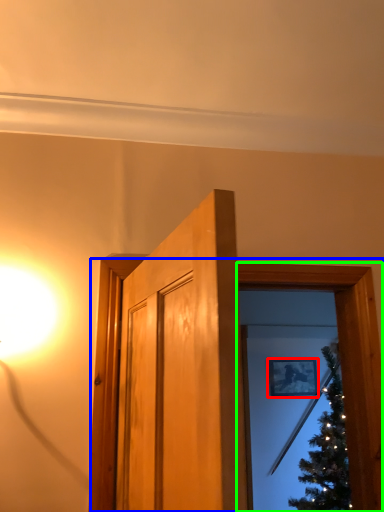
Question: Considering the real-world distances, which object is closest to picture frame (highlighted by a red box)? window frame (highlighted by a blue box) or window frame (highlighted by a green box).

Choices:
 (A) window frame
 (B) window frame

Answer: (A)